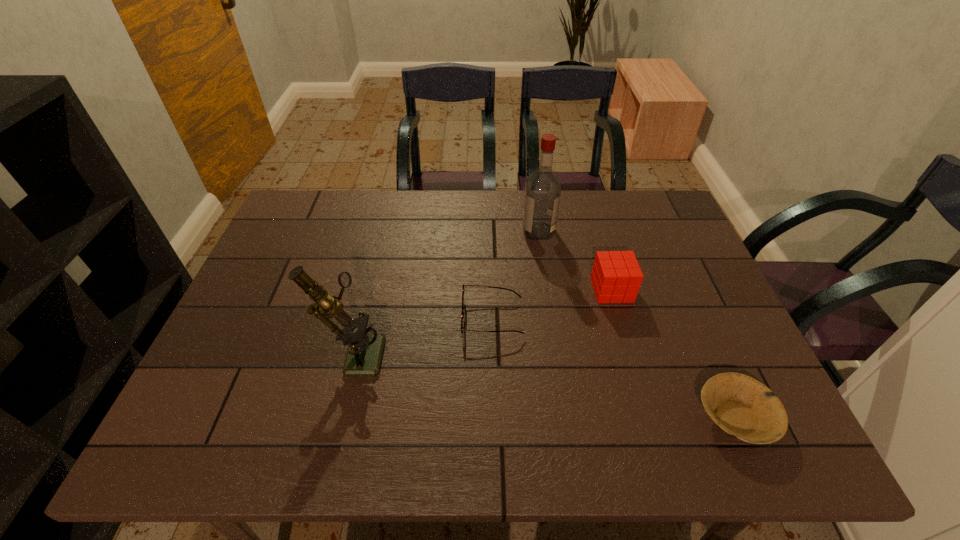
The height and width of the screenshot is (540, 960). Find the location of `free space located 0.180m on the front-facing side of the third object from left to right`. free space located 0.180m on the front-facing side of the third object from left to right is located at coordinates (465, 231).

Locate an element on the screen. This screenshot has height=540, width=960. vacant space located at the eyepiece of the microscope is located at coordinates (497, 352).

Where is `vacant space located 0.100m on the left of the third tallest object`? The height and width of the screenshot is (540, 960). vacant space located 0.100m on the left of the third tallest object is located at coordinates (556, 290).

Find the location of a particular element. free location located on the face of the spectacles is located at coordinates (375, 318).

I want to click on vacant position located 0.100m on the face of the spectacles, so click(x=423, y=318).

You are a GUI agent. You are given a task and a screenshot of the screen. Output one action in this format:
    pyautogui.click(x=<x>, y=<y>)
    Task: Click on the vacant region located on the face of the spectacles
    
    Given the screenshot: What is the action you would take?
    pyautogui.click(x=411, y=318)

This screenshot has width=960, height=540. I want to click on vacant space located on the back of the bowl, so click(x=708, y=355).

Where is `object that is positioned at the far edge`? object that is positioned at the far edge is located at coordinates (542, 197).

The image size is (960, 540). Find the location of `object located in the near edge section of the desktop`. object located in the near edge section of the desktop is located at coordinates (742, 406).

The width and height of the screenshot is (960, 540). I want to click on object that is at the right edge, so click(742, 406).